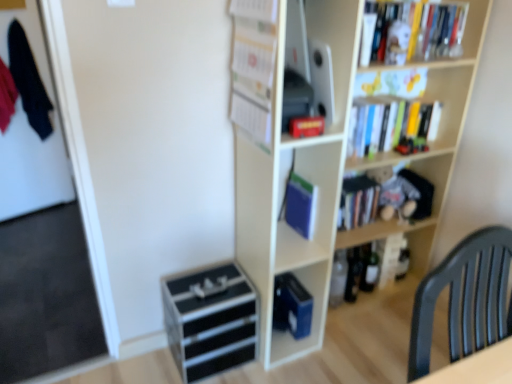
Question: Is hardcover books at upper right looking in the opposite direction of blue matte book at center, the first paperback book ordered from the bottom?

Choices:
 (A) no
 (B) yes

Answer: (A)

Question: Would you consider hardcover books at upper right to be distant from blue matte book at center, acting as the second paperback book starting from the front?

Choices:
 (A) yes
 (B) no

Answer: (B)

Question: Is hardcover books at upper right aimed at blue matte book at center, the 1th paperback book viewed from the back?

Choices:
 (A) yes
 (B) no

Answer: (B)

Question: Considering the relative sizes of hardcover books at upper right and blue matte book at center, the 1th paperback book viewed from the back, in the image provided, is hardcover books at upper right taller than blue matte book at center, the 1th paperback book viewed from the back,?

Choices:
 (A) no
 (B) yes

Answer: (B)

Question: Can you confirm if hardcover books at upper right is shorter than blue matte book at center, acting as the second paperback book starting from the front?

Choices:
 (A) no
 (B) yes

Answer: (A)

Question: From the image's perspective, does hardcover books at upper right appear higher than blue matte book at center, acting as the second paperback book starting from the front?

Choices:
 (A) yes
 (B) no

Answer: (A)

Question: Does dark blue fabric at left turn towards white paper calendar at upper center, acting as the 1th book starting from the front?

Choices:
 (A) no
 (B) yes

Answer: (B)

Question: Does dark blue fabric at left have a smaller size compared to white paper calendar at upper center, the 2th book in the bottom-to-top sequence?

Choices:
 (A) yes
 (B) no

Answer: (B)

Question: Is dark blue fabric at left positioned far away from white paper calendar at upper center, placed as the 3th book when sorted from right to left?

Choices:
 (A) no
 (B) yes

Answer: (B)

Question: Considering the relative positions of dark blue fabric at left and white paper calendar at upper center, placed as the 3th book when sorted from right to left, in the image provided, is dark blue fabric at left to the left of white paper calendar at upper center, placed as the 3th book when sorted from right to left, from the viewer's perspective?

Choices:
 (A) no
 (B) yes

Answer: (B)

Question: From a real-world perspective, is dark blue fabric at left physically above white paper calendar at upper center, the 2th book in the bottom-to-top sequence?

Choices:
 (A) yes
 (B) no

Answer: (B)

Question: Considering the relative sizes of dark blue fabric at left and white paper calendar at upper center, which appears as the 3th book when viewed from the back, in the image provided, is dark blue fabric at left shorter than white paper calendar at upper center, which appears as the 3th book when viewed from the back,?

Choices:
 (A) yes
 (B) no

Answer: (B)

Question: Is wooden bookcase at upper right positioned behind black glass beer bottle at lower center, positioned as the first beer bottle in left-to-right order?

Choices:
 (A) no
 (B) yes

Answer: (A)